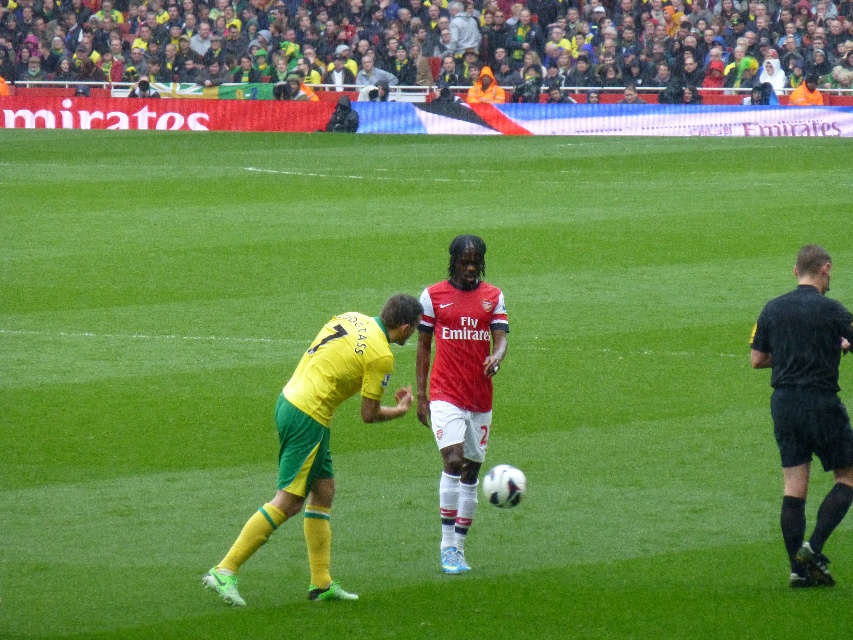
You are a soccer referee positioned at the center of the field. You see two points marked on the field at coordinates point (525, 44) and point (244, 541). Which point is closer to you?

Point (244, 541) is closer to you since it is in front of point (525, 44).